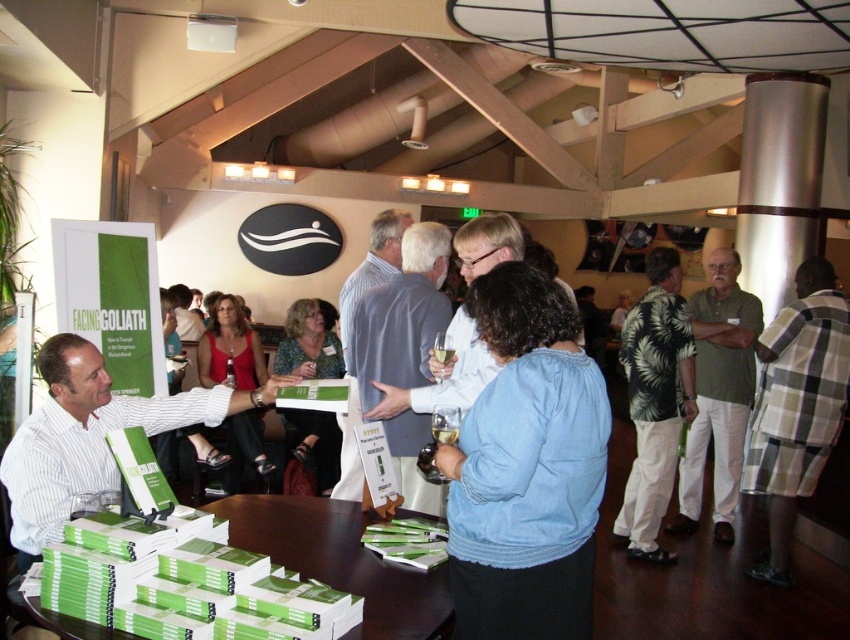
You are attending an event and want to grab a book from the green paper book at lower center without getting too close to the person in the light blue shirt at center. Is this possible?

The green paper book at lower center is closer to the viewer than the light blue shirt at center, so you can reach the book without getting too close to the person in the light blue shirt at center.

You are attending a book signing event and notice two people wearing striped shirts. The first is wearing a white striped shirt at left, and the second is wearing a blue striped shirt at center. If you want to approach the person who is closer to you, which one should you head towards?

The white striped shirt at left is closer to the viewer than the blue striped shirt at center, so you should approach the person wearing the white striped shirt at left.